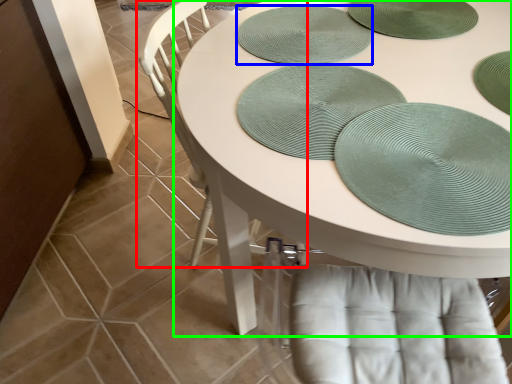
Question: Which object is the closest to the chair (highlighted by a red box)? Choose among these: platter (highlighted by a blue box) or table (highlighted by a green box).

Choices:
 (A) platter
 (B) table

Answer: (B)